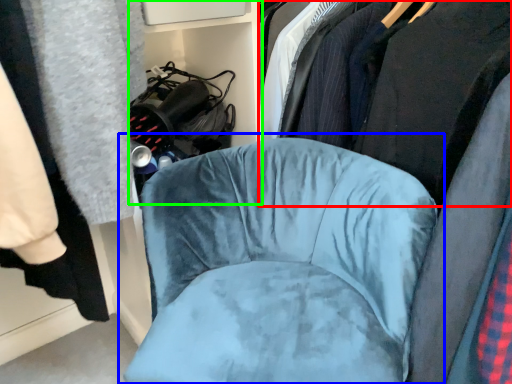
Question: Which object is the farthest from clothing (highlighted by a red box)? Choose among these: chair (highlighted by a blue box) or bookshelf (highlighted by a green box).

Choices:
 (A) chair
 (B) bookshelf

Answer: (B)